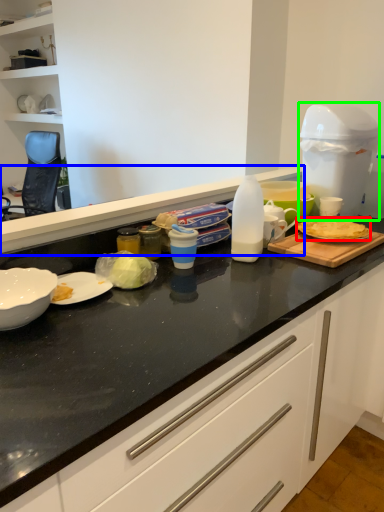
Question: Based on their relative distances, which object is farther from food (highlighted by a red box)? Choose from countertop (highlighted by a blue box) and appliance (highlighted by a green box).

Choices:
 (A) countertop
 (B) appliance

Answer: (A)